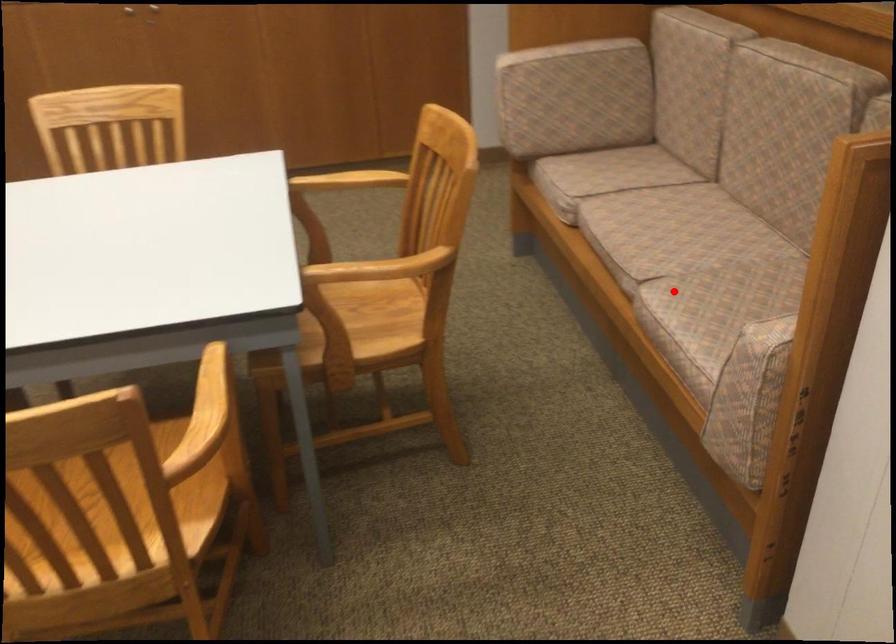
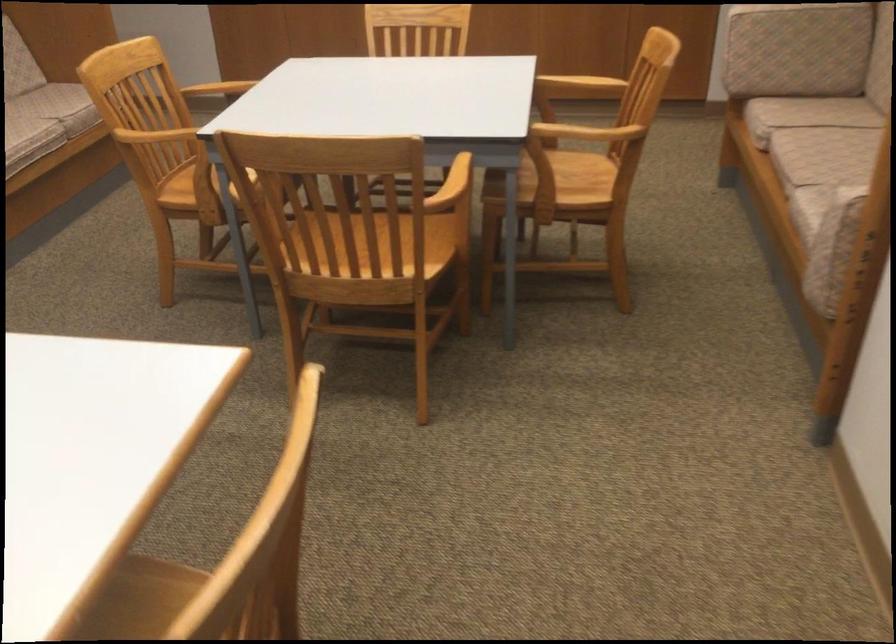
Question: I am providing you with two images of the same scene from different viewpoints. In image1, a red point is highlighted. Considering the same 3D point in image2, which of the following is correct?

Choices:
 (A) It is closer
 (B) It is farther

Answer: (B)